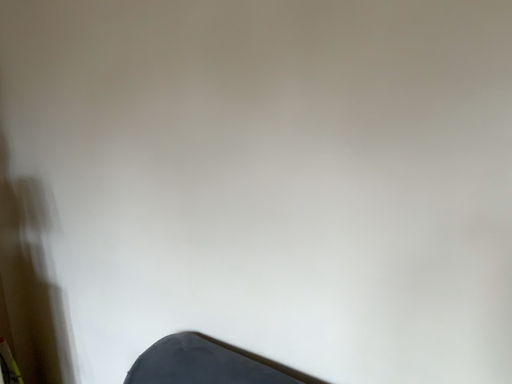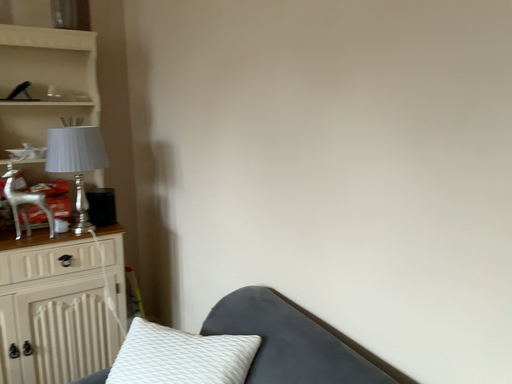
Question: How did the camera likely rotate when shooting the video?

Choices:
 (A) rotated right
 (B) rotated left

Answer: (B)